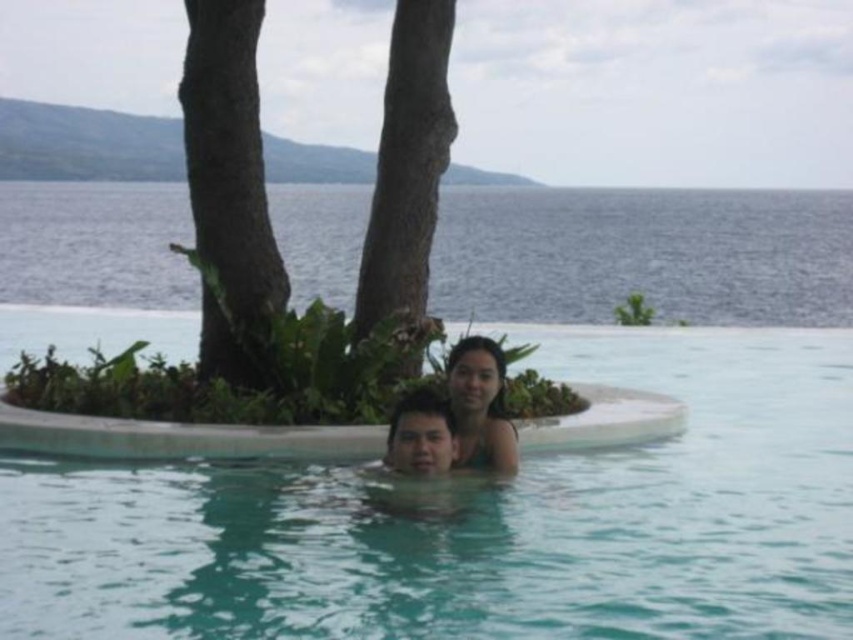
You are a swimmer who wants to swim from the clear blue water at center to the brown rough tree trunk at upper left. Which direction should you swim to reach the tree trunk?

To reach the brown rough tree trunk at upper left from the clear blue water at center, you should swim towards the upper left direction since the tree trunk is located at the upper left relative to the water.